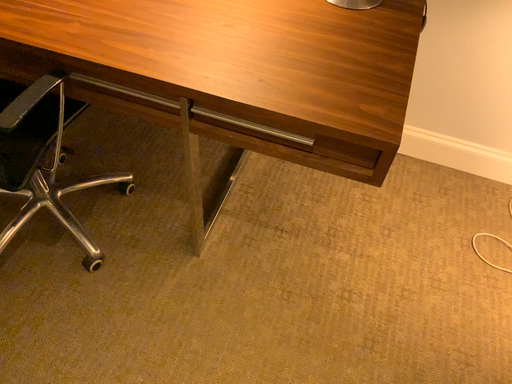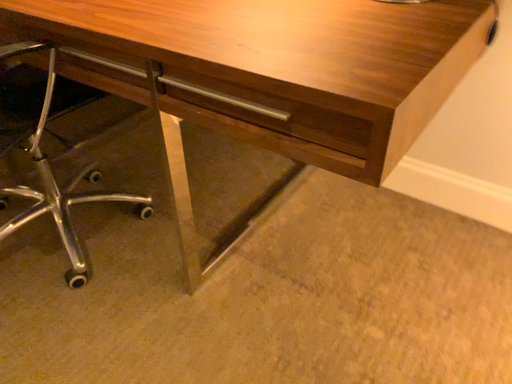
Question: Which way did the camera rotate in the video?

Choices:
 (A) rotated upward
 (B) rotated downward

Answer: (A)